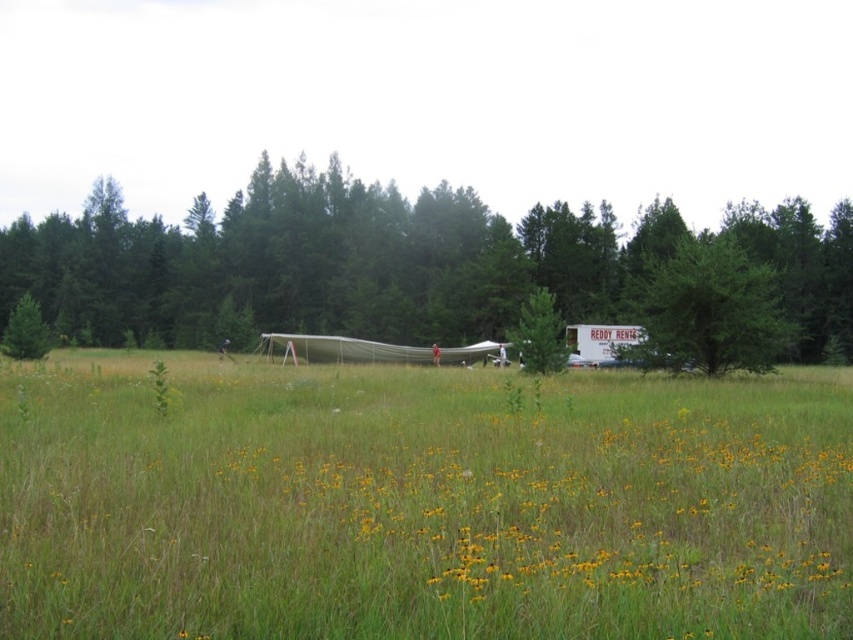
You are standing in the grassy field and want to take a photo of both the green leafy tree at center and the green matte tree at center. Which tree should you focus on first to ensure both are in clear view?

You should focus on the green leafy tree at center first because it is closer to you than the green matte tree at center, allowing both to be in focus when using a camera with depth of field.